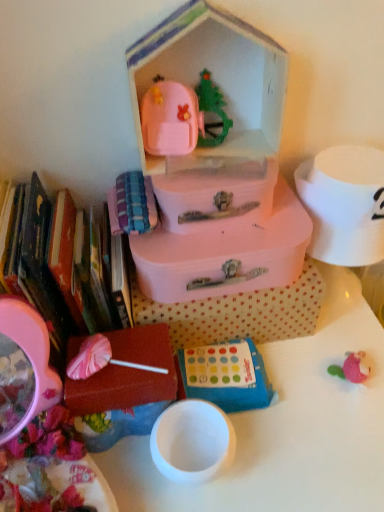
Question: Does blue fabric game at center have a smaller size compared to white glossy table at center?

Choices:
 (A) no
 (B) yes

Answer: (B)

Question: From a real-world perspective, is blue fabric game at center on white glossy table at center?

Choices:
 (A) no
 (B) yes

Answer: (B)

Question: Can you confirm if blue fabric game at center is shorter than white glossy table at center?

Choices:
 (A) no
 (B) yes

Answer: (B)

Question: Is blue fabric game at center further to camera compared to white glossy table at center?

Choices:
 (A) no
 (B) yes

Answer: (B)

Question: Is blue fabric game at center placed right next to white glossy table at center?

Choices:
 (A) yes
 (B) no

Answer: (B)

Question: From the image's perspective, is blue fabric game at center under white glossy table at center?

Choices:
 (A) no
 (B) yes

Answer: (A)

Question: From a real-world perspective, is pink matte suitcase at center, the 2th storage box in the bottom-to-top sequence, positioned under white glossy table at center based on gravity?

Choices:
 (A) no
 (B) yes

Answer: (A)

Question: Is the depth of pink matte suitcase at center, the 2th storage box in the bottom-to-top sequence, less than that of white glossy table at center?

Choices:
 (A) no
 (B) yes

Answer: (A)

Question: Can you confirm if pink matte suitcase at center, the third storage box positioned from the top, is thinner than white glossy table at center?

Choices:
 (A) no
 (B) yes

Answer: (B)

Question: Is pink matte suitcase at center, the 2th storage box in the bottom-to-top sequence, taller than white glossy table at center?

Choices:
 (A) no
 (B) yes

Answer: (A)

Question: Does pink matte suitcase at center, the third storage box positioned from the top, lie behind white glossy table at center?

Choices:
 (A) no
 (B) yes

Answer: (B)

Question: Is pink matte suitcase at center, the 2th storage box in the bottom-to-top sequence, shorter than white glossy table at center?

Choices:
 (A) no
 (B) yes

Answer: (B)

Question: Is white glossy table at center looking in the opposite direction of pink matte lollipop at lower left, the 1th storage box ordered from the bottom?

Choices:
 (A) no
 (B) yes

Answer: (A)